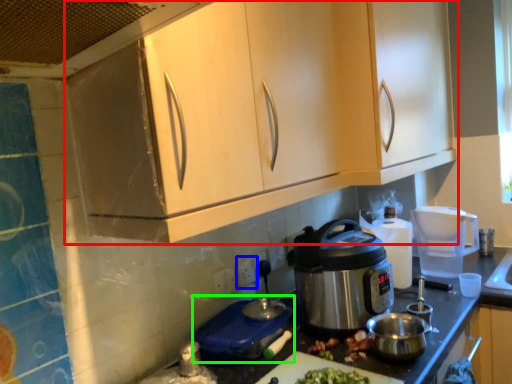
Question: Which object is positioned farthest from cabinetry (highlighted by a red box)? Select from power outlet (highlighted by a blue box) and appliance (highlighted by a green box).

Choices:
 (A) power outlet
 (B) appliance

Answer: (A)